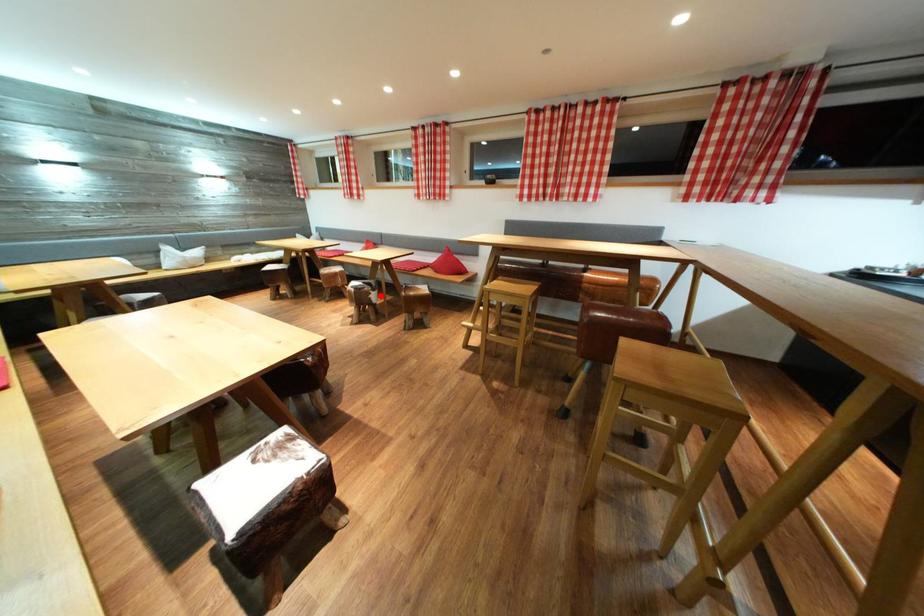
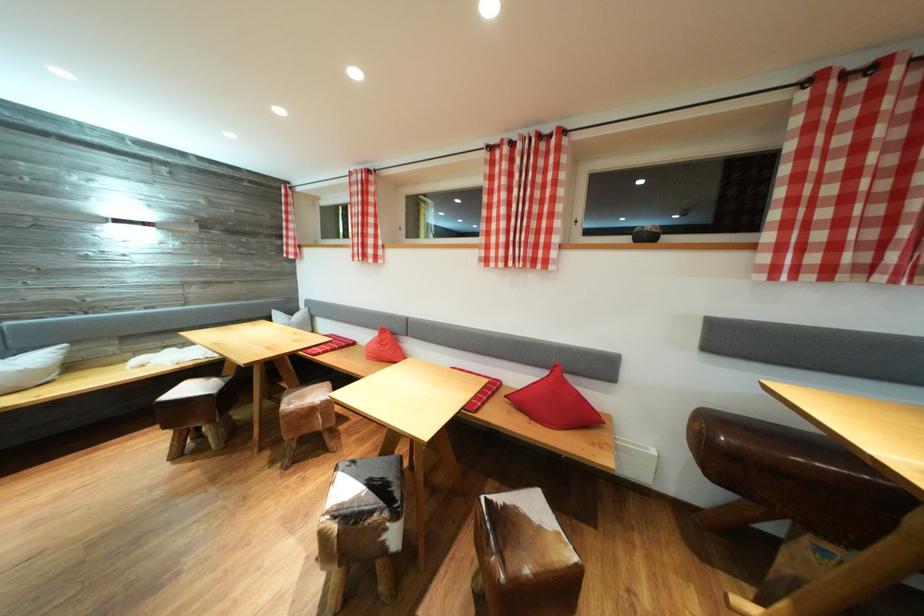
Locate, in the second image, the point that corresponds to the highlighted location in the first image.

(403, 522)